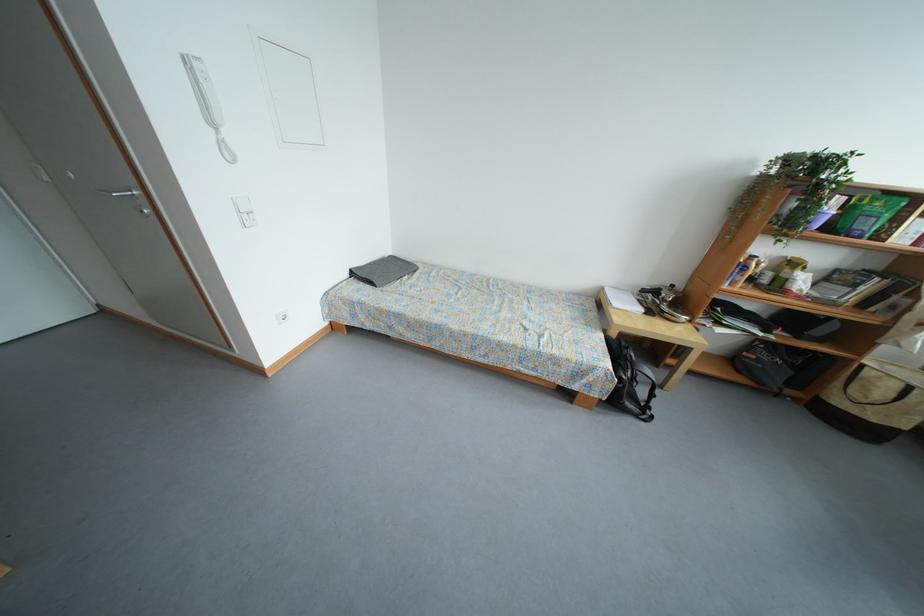
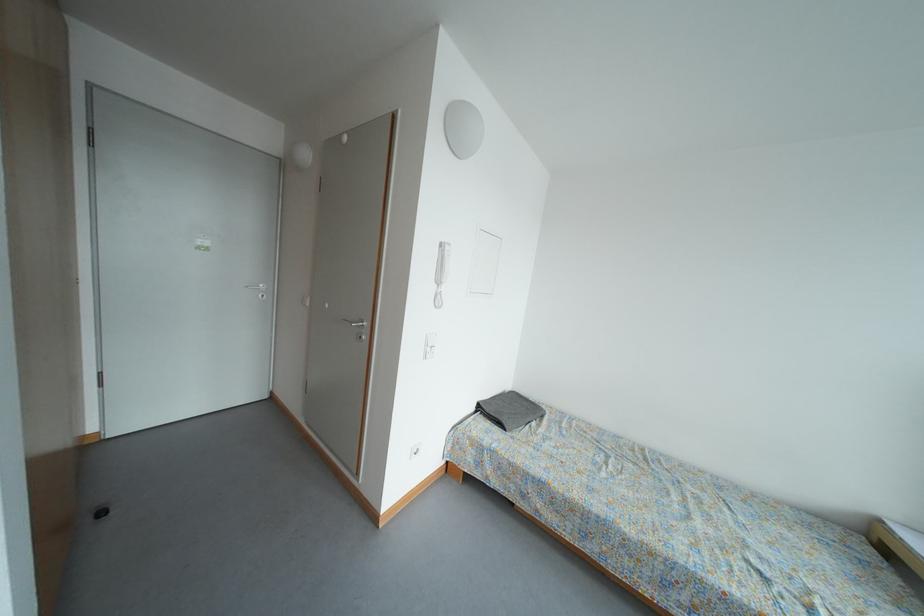
Find the pixel in the second image that matches point 359,278 in the first image.

(485, 411)